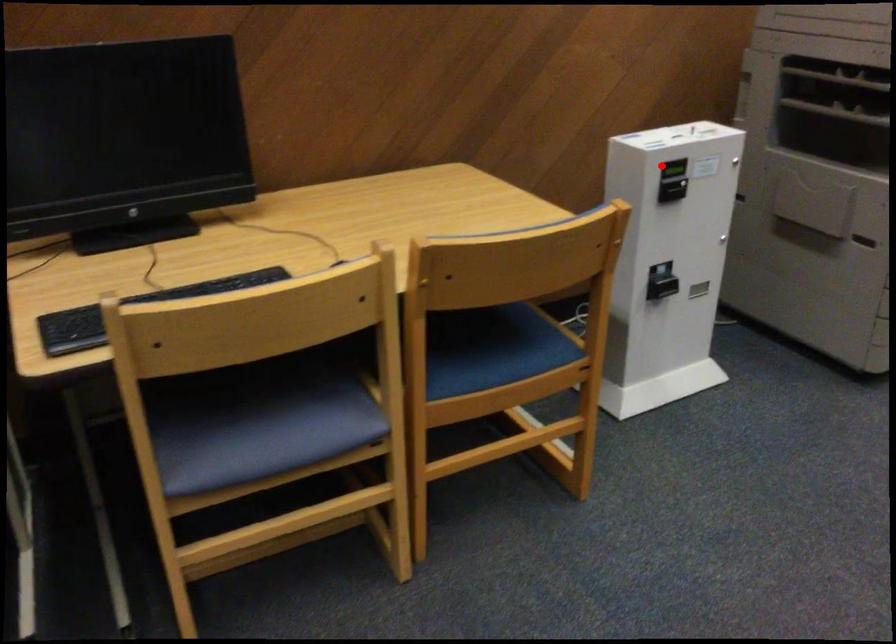
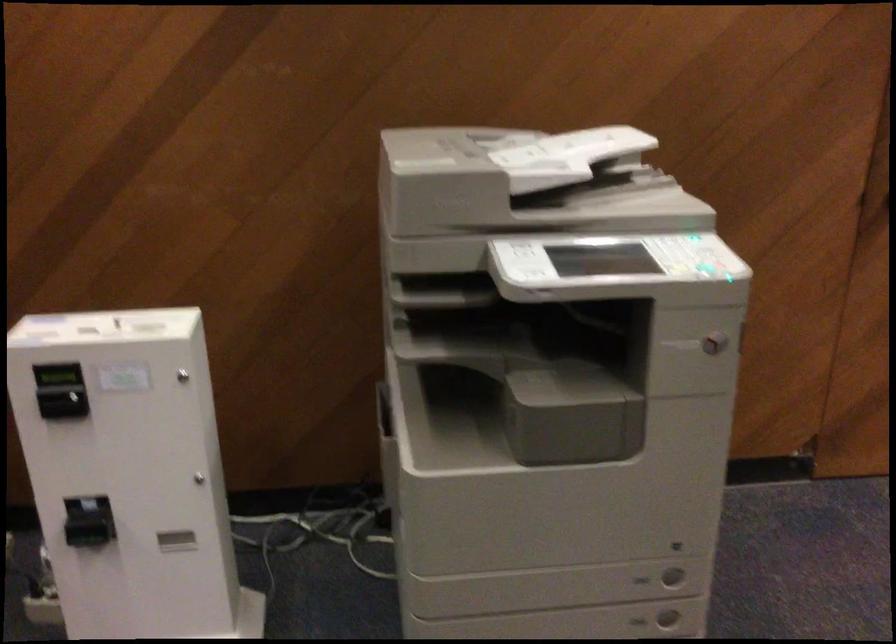
Question: I am providing you with two images of the same scene from different viewpoints. Given a red point in image1, look at the same physical point in image2. Is it:

Choices:
 (A) Closer to the viewpoint
 (B) Farther from the viewpoint

Answer: (A)